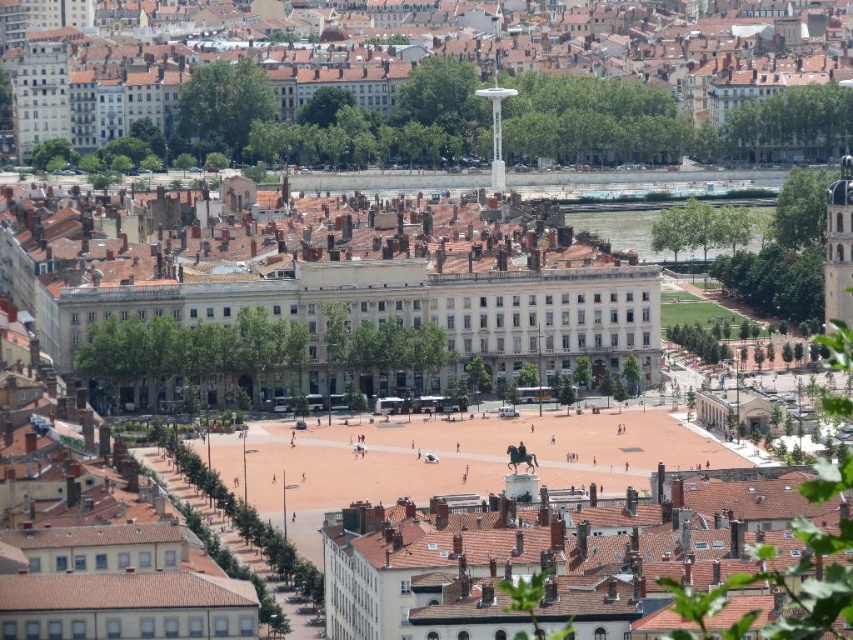
You are a city planner reviewing this urban area. You need to determine which of the two structures, the white glossy building at center or the brown tiled roof at center, requires more maintenance based on their size. According to the scene, which one would need more maintenance?

The white glossy building at center is bigger than the brown tiled roof at center, so it would require more maintenance due to its larger size.

You are standing in the urban square and want to take a photo of both the statue of a horse and rider and the grand neoclassical building. You notice two points marked in the scene. The first point is at coordinate point (204, 49) and the second is at point (830, 504). Which point should you stand at to ensure both the statue of a horse and rider and the grand neoclassical building are in your frame?

You should stand at point (204, 49) because it is closer to the camera, allowing you to capture both the statue of a horse and rider in the foreground and the grand neoclassical building in the midground within the same frame.